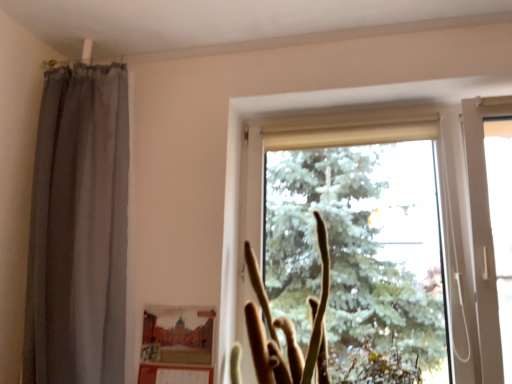
This screenshot has width=512, height=384. What do you see at coordinates (177, 335) in the screenshot? I see `matte cardboard picture frame at lower center` at bounding box center [177, 335].

You are a GUI agent. You are given a task and a screenshot of the screen. Output one action in this format:
    pyautogui.click(x=<x>, y=<y>)
    Task: Click on the brown fuzzy plant at center
    Image resolution: width=512 pixels, height=384 pixels.
    Given the screenshot: What is the action you would take?
    pyautogui.click(x=289, y=328)

Where is `matte cardboard picture frame at lower center`? matte cardboard picture frame at lower center is located at coordinates (177, 335).

From a real-world perspective, between transparent glass window at center and matte cardboard picture frame at lower center, who is vertically higher?

transparent glass window at center.

Based on their positions, is transparent glass window at center located to the left or right of matte cardboard picture frame at lower center?

Clearly, transparent glass window at center is on the right of matte cardboard picture frame at lower center in the image.

Is transparent glass window at center not inside matte cardboard picture frame at lower center?

Yes, transparent glass window at center is not within matte cardboard picture frame at lower center.

Is matte cardboard picture frame at lower center at the back of transparent glass window at center?

No, transparent glass window at center is not facing the opposite direction of matte cardboard picture frame at lower center.

Image resolution: width=512 pixels, height=384 pixels. Identify the location of window lying behind the brown fuzzy plant at center. (380, 234).

Looking at the image, does transparent glass window at center seem bigger or smaller compared to brown fuzzy plant at center?

transparent glass window at center is bigger than brown fuzzy plant at center.

Between point (472, 128) and point (279, 360), which one is positioned behind?

The point (472, 128) is behind.

Is brown fuzzy plant at center at the back of transparent glass window at center?

Correct, transparent glass window at center is looking away from brown fuzzy plant at center.

Looking at this image, between matte cardboard picture frame at lower center and brown fuzzy plant at center, which one has larger width?

Wider between the two is brown fuzzy plant at center.

Consider the image. Would you say matte cardboard picture frame at lower center is inside or outside brown fuzzy plant at center?

matte cardboard picture frame at lower center is located beyond the bounds of brown fuzzy plant at center.

Looking at this image, from the image's perspective, which is below, matte cardboard picture frame at lower center or brown fuzzy plant at center?

matte cardboard picture frame at lower center, from the image's perspective.

Does matte cardboard picture frame at lower center appear on the left side of brown fuzzy plant at center?

Indeed, matte cardboard picture frame at lower center is positioned on the left side of brown fuzzy plant at center.

Is matte cardboard picture frame at lower center inside or outside of transparent glass window at center?

matte cardboard picture frame at lower center exists outside the volume of transparent glass window at center.

Which of these two, matte cardboard picture frame at lower center or transparent glass window at center, is wider?

transparent glass window at center is wider.

Is transparent glass window at center at the back of matte cardboard picture frame at lower center?

matte cardboard picture frame at lower center does not have its back to transparent glass window at center.

Can you confirm if brown fuzzy plant at center is positioned to the left of transparent glass window at center?

Correct, you'll find brown fuzzy plant at center to the left of transparent glass window at center.

From their relative heights in the image, would you say brown fuzzy plant at center is taller or shorter than transparent glass window at center?

Considering their sizes, brown fuzzy plant at center has less height than transparent glass window at center.

Which of these two, brown fuzzy plant at center or transparent glass window at center, is bigger?

Bigger between the two is transparent glass window at center.

Is brown fuzzy plant at center beside transparent glass window at center?

No, brown fuzzy plant at center is not making contact with transparent glass window at center.

Is brown fuzzy plant at center behind matte cardboard picture frame at lower center?

No, brown fuzzy plant at center is closer to the camera.

You are a GUI agent. You are given a task and a screenshot of the screen. Output one action in this format:
    pyautogui.click(x=<x>, y=<y>)
    Task: Click on the plant located above the matte cardboard picture frame at lower center (from the image's perspective)
    This screenshot has width=512, height=384.
    Given the screenshot: What is the action you would take?
    pyautogui.click(x=289, y=328)

Is brown fuzzy plant at center oriented towards matte cardboard picture frame at lower center?

No.

Considering the sizes of objects brown fuzzy plant at center and matte cardboard picture frame at lower center in the image provided, who is taller, brown fuzzy plant at center or matte cardboard picture frame at lower center?

brown fuzzy plant at center.

Where is `picture frame to the left of transparent glass window at center`? The width and height of the screenshot is (512, 384). picture frame to the left of transparent glass window at center is located at coordinates (177, 335).

In the image, there is a transparent glass window at center. Where is `plant below it (from the image's perspective)`? The width and height of the screenshot is (512, 384). plant below it (from the image's perspective) is located at coordinates (289, 328).

When comparing their distances from brown fuzzy plant at center, does transparent glass window at center or matte cardboard picture frame at lower center seem further?

transparent glass window at center lies further to brown fuzzy plant at center than the other object.

From the image, which object appears to be farther from transparent glass window at center, brown fuzzy plant at center or matte cardboard picture frame at lower center?

matte cardboard picture frame at lower center is positioned further to the anchor transparent glass window at center.

Considering their positions, is brown fuzzy plant at center positioned further to matte cardboard picture frame at lower center than transparent glass window at center?

Based on the image, transparent glass window at center appears to be further to matte cardboard picture frame at lower center.

Looking at the image, which one is located closer to transparent glass window at center, matte cardboard picture frame at lower center or brown fuzzy plant at center?

Based on the image, brown fuzzy plant at center appears to be nearer to transparent glass window at center.

When comparing their distances from brown fuzzy plant at center, does matte cardboard picture frame at lower center or transparent glass window at center seem closer?

Based on the image, matte cardboard picture frame at lower center appears to be nearer to brown fuzzy plant at center.

Considering their positions, is transparent glass window at center positioned closer to matte cardboard picture frame at lower center than brown fuzzy plant at center?

Among the two, brown fuzzy plant at center is located nearer to matte cardboard picture frame at lower center.

You are a GUI agent. You are given a task and a screenshot of the screen. Output one action in this format:
    pyautogui.click(x=<x>, y=<y>)
    Task: Click on the plant between matte cardboard picture frame at lower center and transparent glass window at center
    This screenshot has width=512, height=384.
    Given the screenshot: What is the action you would take?
    pyautogui.click(x=289, y=328)